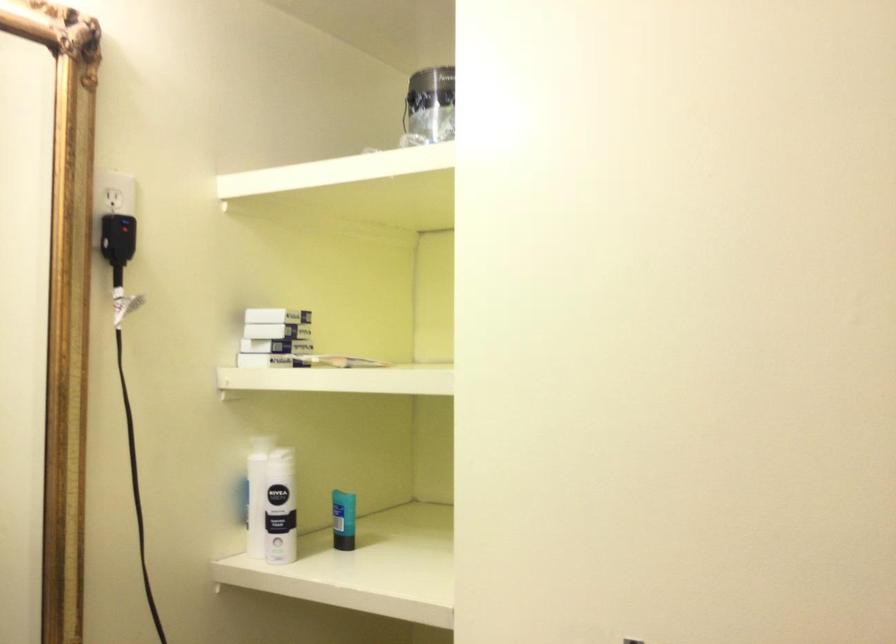
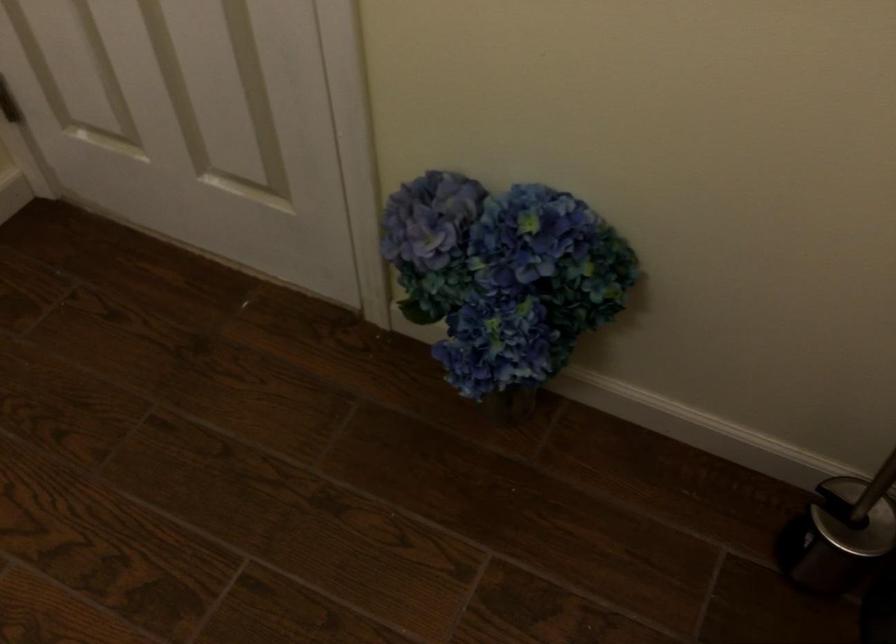
First-person continuous shooting, in which direction is the camera rotating?

The camera rotated toward right-down.